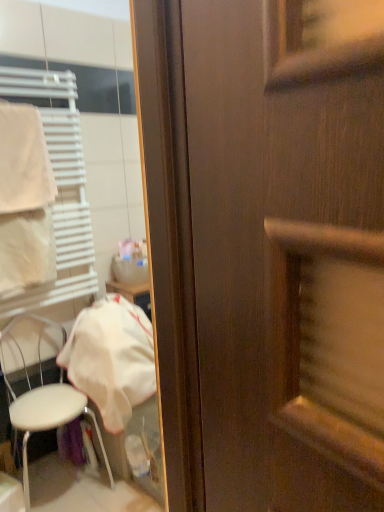
What do you see at coordinates (24, 160) in the screenshot? The width and height of the screenshot is (384, 512). I see `white fabric towel at left` at bounding box center [24, 160].

Find the location of a particular element. white plastic towel rack at left is located at coordinates (58, 191).

I want to click on white fabric towel at left, so click(24, 160).

Considering the positions of objects white fabric at left and white fabric towel at left in the image provided, who is in front, white fabric at left or white fabric towel at left?

white fabric towel at left.

Between white fabric at left and white fabric towel at left, which one has larger size?

Bigger between the two is white fabric at left.

Locate an element on the screen. towel/napkin on the left of white fabric at left is located at coordinates (24, 160).

Would you say white plastic chair at lower left is inside or outside white fabric towel at left?

white plastic chair at lower left is spatially situated outside white fabric towel at left.

From a real-world perspective, which is physically below, white plastic chair at lower left or white fabric towel at left?

From a 3D spatial view, white plastic chair at lower left is below.

Between white plastic chair at lower left and white fabric towel at left, which one has smaller width?

Thinner between the two is white fabric towel at left.

Which is behind, white plastic chair at lower left or white fabric towel at left?

Positioned behind is white fabric towel at left.

From the image's perspective, which object appears higher, white fabric at left or white plastic towel rack at left?

From the image's view, white plastic towel rack at left is above.

Which object is thinner, white fabric at left or white plastic towel rack at left?

With smaller width is white plastic towel rack at left.

Considering the positions of point (94, 323) and point (17, 68), is point (94, 323) closer or farther from the camera than point (17, 68)?

Point (94, 323) appears to be farther away from the viewer than point (17, 68).

Would you say white fabric at left is outside white plastic towel rack at left?

Absolutely, white fabric at left is external to white plastic towel rack at left.

You are a GUI agent. You are given a task and a screenshot of the screen. Output one action in this format:
    pyautogui.click(x=<x>, y=<y>)
    Task: Click on the chair on the left of white fabric at left
    
    Given the screenshot: What is the action you would take?
    pyautogui.click(x=49, y=418)

Which point is more forward, [75,326] or [24,483]?

The point [24,483] is closer.

Considering the sizes of objects white fabric at left and white plastic chair at lower left in the image provided, who is thinner, white fabric at left or white plastic chair at lower left?

Thinner between the two is white plastic chair at lower left.

How many degrees apart are the facing directions of white fabric at left and white plastic chair at lower left?

The angle between the facing direction of white fabric at left and the facing direction of white plastic chair at lower left is 2.41e-05 degrees.

Could you tell me if white fabric towel at left is facing white fabric at left?

No, white fabric towel at left is not turned towards white fabric at left.

Is white fabric at left surrounded by white fabric towel at left?

No, white fabric at left is not surrounded by white fabric towel at left.

Is white fabric towel at left smaller than white fabric at left?

Yes.

How different are the orientations of white fabric towel at left and white fabric at left in degrees?

They differ by 1.03 degrees in their facing directions.

From the image's perspective, does white fabric towel at left appear higher than white plastic chair at lower left?

Yes.

Locate an element on the screen. This screenshot has width=384, height=512. chair on the right of white fabric towel at left is located at coordinates coord(49,418).

Does white fabric towel at left contain white plastic chair at lower left?

No, white plastic chair at lower left is not a part of white fabric towel at left.

Which object is wider, white plastic chair at lower left or white fabric at left?

Wider between the two is white fabric at left.

Who is taller, white plastic chair at lower left or white fabric at left?

With more height is white plastic chair at lower left.

Does white plastic chair at lower left have a smaller size compared to white fabric at left?

No, white plastic chair at lower left is not smaller than white fabric at left.

At what (x,y) coordinates should I click in order to perform the action: click on towel/napkin on the left of white fabric at left. Please return your answer as a coordinate pair (x, y). This screenshot has height=512, width=384. Looking at the image, I should click on (24, 160).

Image resolution: width=384 pixels, height=512 pixels. I want to click on towel/napkin that appears above the white plastic chair at lower left (from the image's perspective), so click(24, 160).

Estimate the real-world distances between objects in this image. Which object is closer to white plastic towel rack at left, white fabric towel at left or white plastic chair at lower left?

white fabric towel at left lies closer to white plastic towel rack at left than the other object.

Estimate the real-world distances between objects in this image. Which object is closer to white fabric at left, white plastic chair at lower left or white plastic towel rack at left?

Among the two, white plastic chair at lower left is located nearer to white fabric at left.

Which object lies nearer to the anchor point white fabric at left, white plastic chair at lower left or white fabric towel at left?

white plastic chair at lower left.

Estimate the real-world distances between objects in this image. Which object is further from white plastic towel rack at left, white plastic chair at lower left or white fabric at left?

The object further to white plastic towel rack at left is white plastic chair at lower left.

From the image, which object appears to be nearer to white fabric towel at left, white plastic towel rack at left or white plastic chair at lower left?

white plastic towel rack at left is positioned closer to the anchor white fabric towel at left.

From the image, which object appears to be farther from white fabric towel at left, white plastic chair at lower left or white fabric at left?

The object further to white fabric towel at left is white plastic chair at lower left.

When comparing their distances from white plastic chair at lower left, does white fabric towel at left or white fabric at left seem closer?

white fabric at left lies closer to white plastic chair at lower left than the other object.

Considering their positions, is white fabric at left positioned closer to white plastic towel rack at left than white plastic chair at lower left?

The object closer to white plastic towel rack at left is white fabric at left.

Locate an element on the screen. The height and width of the screenshot is (512, 384). cloth between white plastic towel rack at left and white plastic chair at lower left vertically is located at coordinates (111, 358).

You are a GUI agent. You are given a task and a screenshot of the screen. Output one action in this format:
    pyautogui.click(x=<x>, y=<y>)
    Task: Click on the cloth between white fabric towel at left and white plastic chair at lower left from top to bottom
    
    Given the screenshot: What is the action you would take?
    pyautogui.click(x=111, y=358)

I want to click on shutter between white fabric towel at left and white fabric at left from top to bottom, so click(x=58, y=191).

This screenshot has width=384, height=512. Identify the location of shutter between white fabric towel at left and white plastic chair at lower left vertically. (58, 191).